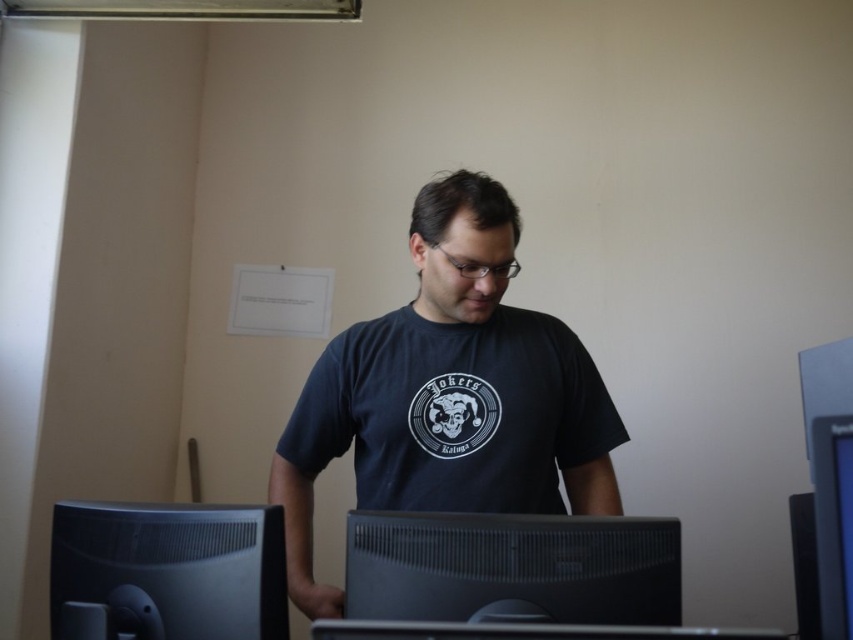
Which is in front, point (390, 412) or point (679, 620)?

Point (679, 620)

How far apart are dark blue cotton t-shirt at center and black plastic monitor at center?

dark blue cotton t-shirt at center is 16.11 inches from black plastic monitor at center.

Which is behind, point (349, 372) or point (573, 593)?

Point (349, 372)

At what (x,y) coordinates should I click in order to perform the action: click on dark blue cotton t-shirt at center. Please return your answer as a coordinate pair (x, y). The image size is (853, 640). Looking at the image, I should click on (454, 412).

Is black matte computer monitor at lower left to the right of black glossy monitor at center from the viewer's perspective?

In fact, black matte computer monitor at lower left is to the left of black glossy monitor at center.

Which is behind, point (200, 540) or point (834, 477)?

The point (200, 540) is behind.

What do you see at coordinates (166, 572) in the screenshot? The height and width of the screenshot is (640, 853). I see `black matte computer monitor at lower left` at bounding box center [166, 572].

Where is `black matte computer monitor at lower left`? This screenshot has width=853, height=640. black matte computer monitor at lower left is located at coordinates (166, 572).

Is dark blue t-shirt at center below black matte computer monitor at lower left?

Incorrect, dark blue t-shirt at center is not positioned below black matte computer monitor at lower left.

Measure the distance from dark blue t-shirt at center to black matte computer monitor at lower left.

They are 13.64 inches apart.

Between point (469, 243) and point (99, 579), which one is positioned behind?

The point (469, 243) is behind.

The width and height of the screenshot is (853, 640). I want to click on dark blue t-shirt at center, so click(x=450, y=394).